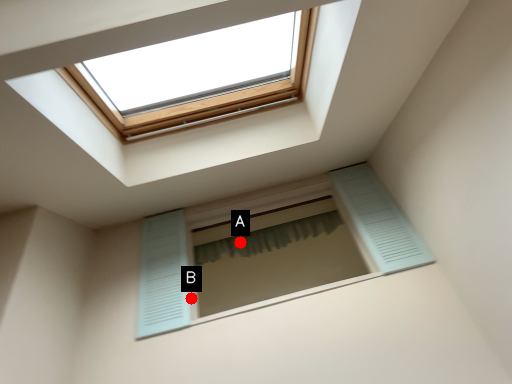
Question: Two points are circled on the image, labeled by A and B beside each circle. Which point is farther to the camera?

Choices:
 (A) A is further
 (B) B is further

Answer: (A)